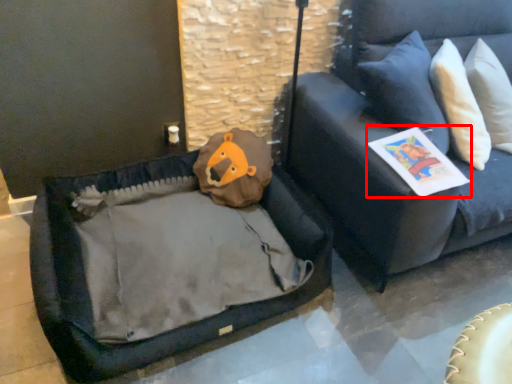
Question: From the image's perspective, where is magazine (annotated by the red box) located relative to studio couch?

Choices:
 (A) below
 (B) above

Answer: (A)